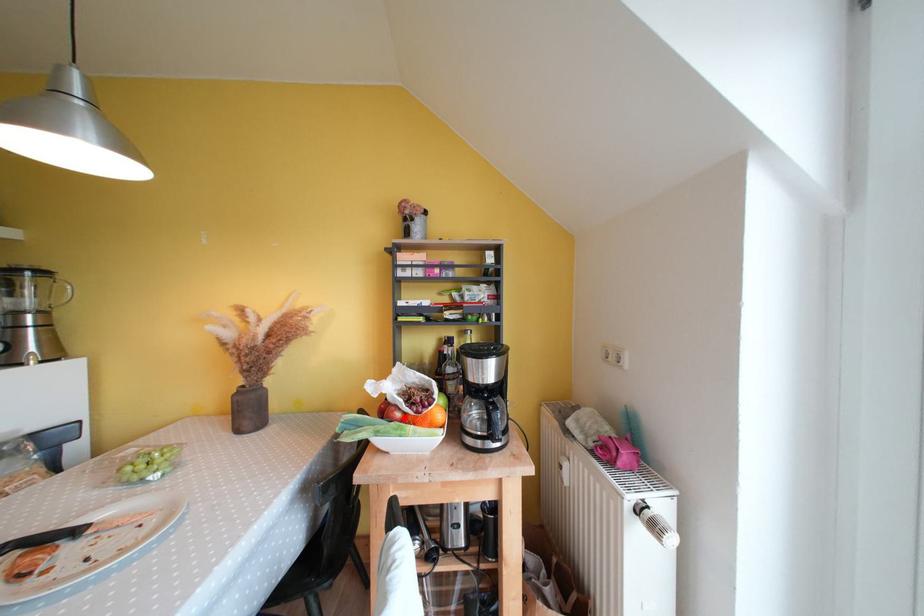
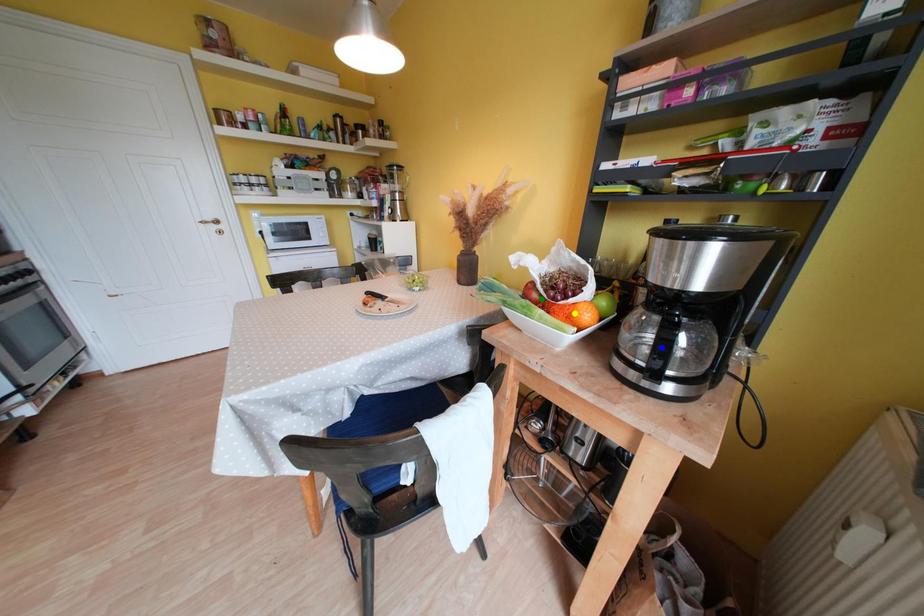
Question: I am providing you with two images of the same scene from different viewpoints. A red point is marked on the first image. You are given multiple points on the second image. Can you choose the point in image 2 that corresponds to the point in image 1?

Choices:
 (A) yellow point
 (B) blue point
 (C) green point

Answer: (C)